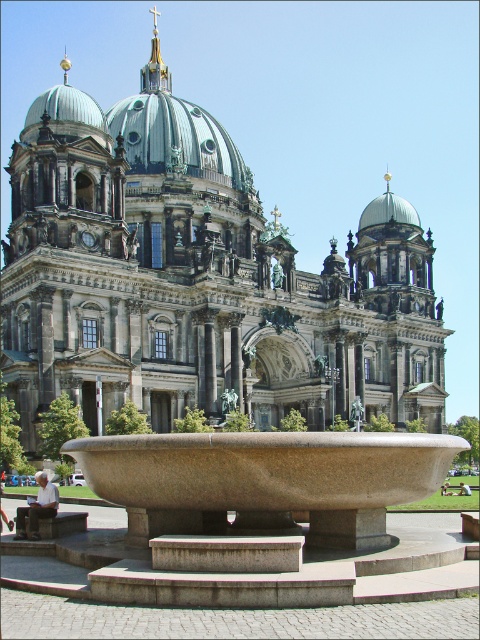
Question: Can you confirm if dark gray stone church at center is wider than green copper dome at center?

Choices:
 (A) yes
 (B) no

Answer: (A)

Question: Which of these objects is positioned closest to the green copper dome at center?

Choices:
 (A) dark gray stone church at center
 (B) brown stone fountain at center

Answer: (A)

Question: Considering the real-world distances, which object is closest to the dark gray stone church at center?

Choices:
 (A) brown stone fountain at center
 (B) green copper dome at center

Answer: (A)

Question: Estimate the real-world distances between objects in this image. Which object is closer to the brown stone fountain at center?

Choices:
 (A) dark gray stone church at center
 (B) green copper dome at center

Answer: (A)

Question: Considering the relative positions of brown stone fountain at center and green copper dome at center in the image provided, where is brown stone fountain at center located with respect to green copper dome at center?

Choices:
 (A) left
 (B) right

Answer: (A)

Question: Is brown stone fountain at center below green copper dome at center?

Choices:
 (A) yes
 (B) no

Answer: (A)